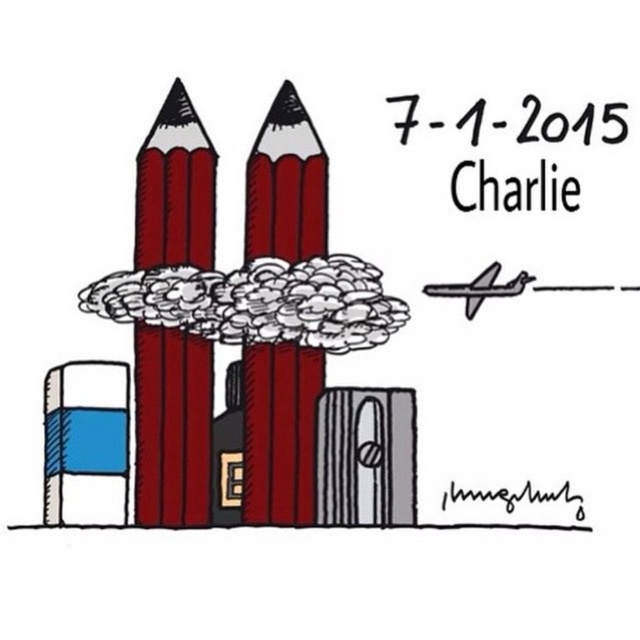
Between matte red crayon at left and matte red pencil at center, which one has less height?

matte red pencil at center is shorter.

Does matte red crayon at left have a smaller size compared to matte red pencil at center?

Yes, matte red crayon at left is smaller than matte red pencil at center.

Locate an element on the screen. This screenshot has height=640, width=640. matte red crayon at left is located at coordinates (172, 426).